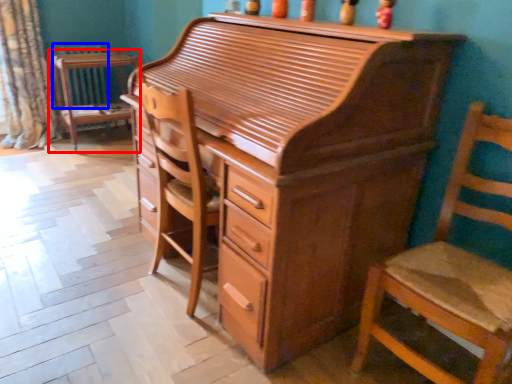
Question: Among these objects, which one is nearest to the camera, table (highlighted by a red box) or radiator (highlighted by a blue box)?

Choices:
 (A) table
 (B) radiator

Answer: (A)